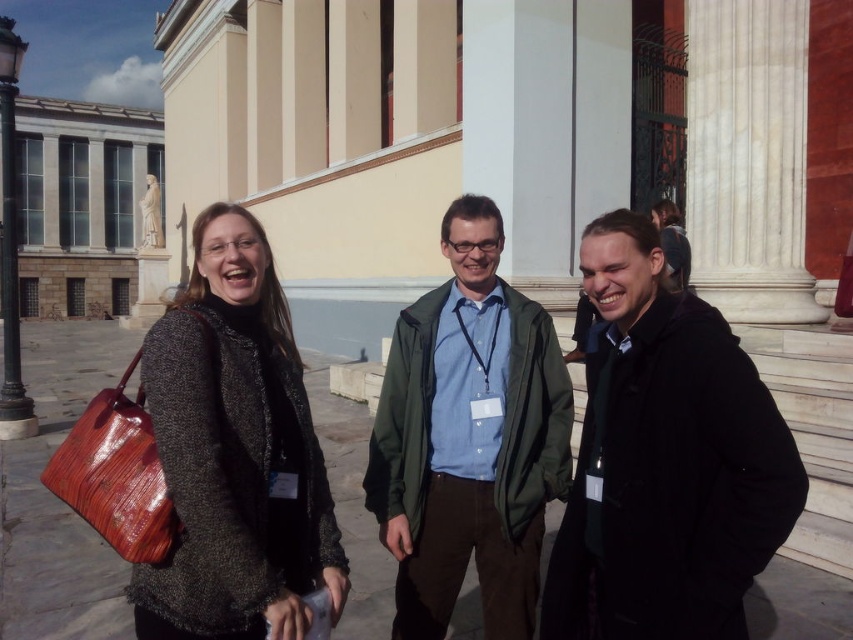
You are a photographer trying to capture the knitted gray sweater at center and the green matte jacket at center in a single shot. Which clothing item is positioned higher on the person wearing it?

The knitted gray sweater at center is above the green matte jacket at center, so the sweater is positioned higher on the person wearing it.

Based on the scene description, can you identify the object located at the coordinates point [665,460]?

The coordinates point [665,460] indicate the location of the black matte jacket at center.